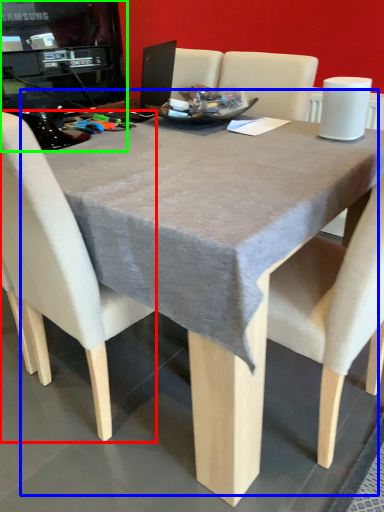
Question: Based on their relative distances, which object is nearer to chair (highlighted by a red box)? Choose from table (highlighted by a blue box) and desktop computer (highlighted by a green box).

Choices:
 (A) table
 (B) desktop computer

Answer: (A)